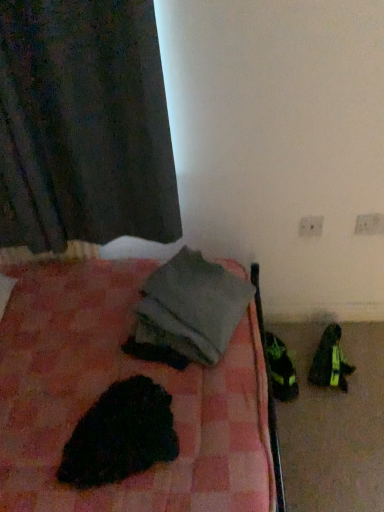
Measure the distance between point (x=6, y=198) and camera.

A distance of 1.43 meters exists between point (x=6, y=198) and camera.

In order to face shiny black shoes at lower right, should I rotate leftwards or rightwards?

It's best to rotate right around 17.625 degrees.

Describe the element at coordinates (330, 361) in the screenshot. I see `shiny black shoes at lower right` at that location.

Locate an element on the screen. Image resolution: width=384 pixels, height=512 pixels. white plastic electric outlet at upper right, marked as the 2th electric outlet in a right-to-left arrangement is located at coordinates (311, 226).

What is the approximate height of white plastic electric outlet at upper right, positioned as the first electric outlet in left-to-right order?

It is 3.39 inches.

The height and width of the screenshot is (512, 384). What are the coordinates of `dark matte fabric curtain at upper left` in the screenshot? It's located at (83, 125).

Between white plastic electric outlet at upper right, marked as the 2th electric outlet in a right-to-left arrangement, and black fuzzy animal at lower left, which one has smaller width?

Thinner between the two is white plastic electric outlet at upper right, marked as the 2th electric outlet in a right-to-left arrangement.

Considering the relative sizes of white plastic electric outlet at upper right, positioned as the first electric outlet in left-to-right order, and black fuzzy animal at lower left in the image provided, is white plastic electric outlet at upper right, positioned as the first electric outlet in left-to-right order, bigger than black fuzzy animal at lower left?

Actually, white plastic electric outlet at upper right, positioned as the first electric outlet in left-to-right order, might be smaller than black fuzzy animal at lower left.

Does point (301, 226) appear closer or farther from the camera than point (118, 433)?

Point (301, 226) is farther from the camera than point (118, 433).

From the image's perspective, which is below, white plastic electric outlet at upper right, marked as the 2th electric outlet in a right-to-left arrangement, or shiny black shoes at lower right?

shiny black shoes at lower right, from the image's perspective.

Considering the relative positions of white plastic electric outlet at upper right, positioned as the first electric outlet in left-to-right order, and shiny black shoes at lower right in the image provided, is white plastic electric outlet at upper right, positioned as the first electric outlet in left-to-right order, to the right of shiny black shoes at lower right from the viewer's perspective?

No, white plastic electric outlet at upper right, positioned as the first electric outlet in left-to-right order, is not to the right of shiny black shoes at lower right.

Looking at their sizes, would you say white plastic electric outlet at upper right, positioned as the first electric outlet in left-to-right order, is wider or thinner than shiny black shoes at lower right?

In the image, white plastic electric outlet at upper right, positioned as the first electric outlet in left-to-right order, appears to be more narrow than shiny black shoes at lower right.

Is white plastic electric outlet at upper right, positioned as the first electric outlet in left-to-right order, looking in the opposite direction of shiny black shoes at lower right?

No, white plastic electric outlet at upper right, positioned as the first electric outlet in left-to-right order, is not facing the opposite direction of shiny black shoes at lower right.

Which is behind, white plastic electric outlet at upper right, marked as the 2th electric outlet in a right-to-left arrangement, or gray fabric at center?

white plastic electric outlet at upper right, marked as the 2th electric outlet in a right-to-left arrangement.

Can you tell me how much white plastic electric outlet at upper right, marked as the 2th electric outlet in a right-to-left arrangement, and gray fabric at center differ in facing direction?

white plastic electric outlet at upper right, marked as the 2th electric outlet in a right-to-left arrangement, and gray fabric at center are facing 66.2 degrees away from each other.

Are white plastic electric outlet at upper right, marked as the 2th electric outlet in a right-to-left arrangement, and gray fabric at center making contact?

There is a gap between white plastic electric outlet at upper right, marked as the 2th electric outlet in a right-to-left arrangement, and gray fabric at center.

Where is `clothing on the left of white plastic electric outlet at upper right, positioned as the first electric outlet in left-to-right order`? This screenshot has height=512, width=384. clothing on the left of white plastic electric outlet at upper right, positioned as the first electric outlet in left-to-right order is located at coordinates (192, 307).

Is shiny black shoes at lower right oriented towards gray fabric at center?

No, shiny black shoes at lower right is not aimed at gray fabric at center.

From the image's perspective, is shiny black shoes at lower right above or below gray fabric at center?

shiny black shoes at lower right is below gray fabric at center.

Does point (325, 337) come farther from viewer compared to point (177, 287)?

Yes, point (325, 337) is behind point (177, 287).

Is shiny black shoes at lower right shorter than gray fabric at center?

Indeed, shiny black shoes at lower right has a lesser height compared to gray fabric at center.

Is gray fabric at center directly adjacent to shiny black shoes at lower right?

No, gray fabric at center is not making contact with shiny black shoes at lower right.

From a real-world perspective, is gray fabric at center above or below shiny black shoes at lower right?

In terms of real-world spatial position, gray fabric at center is above shiny black shoes at lower right.

What's the angular difference between gray fabric at center and shiny black shoes at lower right's facing directions?

There is a 74.7-degree angle between the facing directions of gray fabric at center and shiny black shoes at lower right.

Is gray fabric at center bigger than shiny black shoes at lower right?

Yes.

Is white plastic electric outlet at upper right, which is counted as the 1th electric outlet, starting from the right, in front of white plastic electric outlet at upper right, marked as the 2th electric outlet in a right-to-left arrangement?

That is True.

Which is more to the left, white plastic electric outlet at upper right, which is counted as the 1th electric outlet, starting from the right, or white plastic electric outlet at upper right, marked as the 2th electric outlet in a right-to-left arrangement?

From the viewer's perspective, white plastic electric outlet at upper right, marked as the 2th electric outlet in a right-to-left arrangement, appears more on the left side.

You are a GUI agent. You are given a task and a screenshot of the screen. Output one action in this format:
    pyautogui.click(x=<x>, y=<y>)
    Task: Click on the electric outlet behind the white plastic electric outlet at upper right, which is counted as the 1th electric outlet, starting from the right
    This screenshot has width=384, height=512.
    Given the screenshot: What is the action you would take?
    pyautogui.click(x=311, y=226)

Can you confirm if white plastic electric outlet at upper right, positioned as the second electric outlet in left-to-right order, is thinner than white plastic electric outlet at upper right, positioned as the first electric outlet in left-to-right order?

In fact, white plastic electric outlet at upper right, positioned as the second electric outlet in left-to-right order, might be wider than white plastic electric outlet at upper right, positioned as the first electric outlet in left-to-right order.

The width and height of the screenshot is (384, 512). I want to click on the 2nd electric outlet to the right when counting from the dark matte fabric curtain at upper left, so click(x=369, y=224).

In the scene shown: Would you say white plastic electric outlet at upper right, positioned as the second electric outlet in left-to-right order, is inside or outside dark matte fabric curtain at upper left?

The correct answer is: outside.

Considering the points (358, 216) and (82, 53), which point is behind, point (358, 216) or point (82, 53)?

The point (358, 216) is farther.

This screenshot has width=384, height=512. What are the coordinates of `animal that appears below the white plastic electric outlet at upper right, positioned as the first electric outlet in left-to-right order (from the image's perspective)` in the screenshot? It's located at (120, 435).

You are a GUI agent. You are given a task and a screenshot of the screen. Output one action in this format:
    pyautogui.click(x=<x>, y=<y>)
    Task: Click on the footwear in front of the white plastic electric outlet at upper right, positioned as the first electric outlet in left-to-right order
    
    Given the screenshot: What is the action you would take?
    pyautogui.click(x=330, y=361)

When comparing their distances from dark matte fabric curtain at upper left, does shiny black shoes at lower right or gray fabric at center seem further?

Based on the image, shiny black shoes at lower right appears to be further to dark matte fabric curtain at upper left.

When comparing their distances from shiny black shoes at lower right, does dark matte fabric curtain at upper left or white plastic electric outlet at upper right, positioned as the first electric outlet in left-to-right order, seem closer?

white plastic electric outlet at upper right, positioned as the first electric outlet in left-to-right order, is closer to shiny black shoes at lower right.

In the scene shown: Which object lies nearer to the anchor point gray fabric at center, shiny black shoes at lower right or white plastic electric outlet at upper right, marked as the 2th electric outlet in a right-to-left arrangement?

white plastic electric outlet at upper right, marked as the 2th electric outlet in a right-to-left arrangement.

Based on their spatial positions, is shiny black shoes at lower right or black fuzzy animal at lower left closer to white plastic electric outlet at upper right, positioned as the second electric outlet in left-to-right order?

shiny black shoes at lower right is positioned closer to the anchor white plastic electric outlet at upper right, positioned as the second electric outlet in left-to-right order.

From the image, which object appears to be farther from black fuzzy animal at lower left, gray fabric at center or shiny black shoes at lower right?

Among the two, shiny black shoes at lower right is located further to black fuzzy animal at lower left.

When comparing their distances from dark matte fabric curtain at upper left, does gray fabric at center or white plastic electric outlet at upper right, marked as the 2th electric outlet in a right-to-left arrangement, seem closer?

gray fabric at center is positioned closer to the anchor dark matte fabric curtain at upper left.

Estimate the real-world distances between objects in this image. Which object is closer to white plastic electric outlet at upper right, positioned as the second electric outlet in left-to-right order, dark matte fabric curtain at upper left or shiny black shoes at lower right?

shiny black shoes at lower right is positioned closer to the anchor white plastic electric outlet at upper right, positioned as the second electric outlet in left-to-right order.

Which object lies further to the anchor point white plastic electric outlet at upper right, marked as the 2th electric outlet in a right-to-left arrangement, dark matte fabric curtain at upper left or shiny black shoes at lower right?

dark matte fabric curtain at upper left lies further to white plastic electric outlet at upper right, marked as the 2th electric outlet in a right-to-left arrangement, than the other object.

Where is `clothing between dark matte fabric curtain at upper left and black fuzzy animal at lower left from top to bottom`? This screenshot has width=384, height=512. clothing between dark matte fabric curtain at upper left and black fuzzy animal at lower left from top to bottom is located at coordinates (192, 307).

Identify the location of clothing between dark matte fabric curtain at upper left and shiny black shoes at lower right from left to right. (192, 307).

You are a GUI agent. You are given a task and a screenshot of the screen. Output one action in this format:
    pyautogui.click(x=<x>, y=<y>)
    Task: Click on the clothing located between black fuzzy animal at lower left and white plastic electric outlet at upper right, which is counted as the 1th electric outlet, starting from the right, in the left-right direction
    The width and height of the screenshot is (384, 512).
    Given the screenshot: What is the action you would take?
    pyautogui.click(x=192, y=307)

Identify the location of clothing between black fuzzy animal at lower left and shiny black shoes at lower right. Image resolution: width=384 pixels, height=512 pixels. (192, 307).